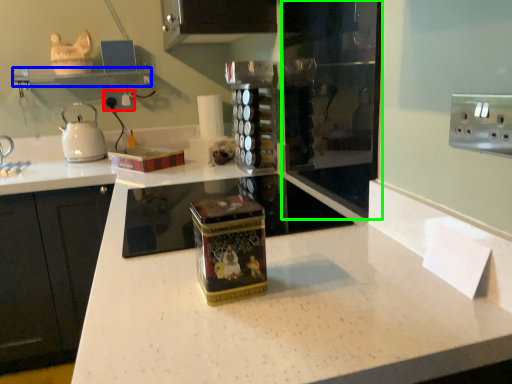
Question: Based on their relative distances, which object is nearer to electric outlet (highlighted by a red box)? Choose from shelf (highlighted by a blue box) and glass door (highlighted by a green box).

Choices:
 (A) shelf
 (B) glass door

Answer: (A)